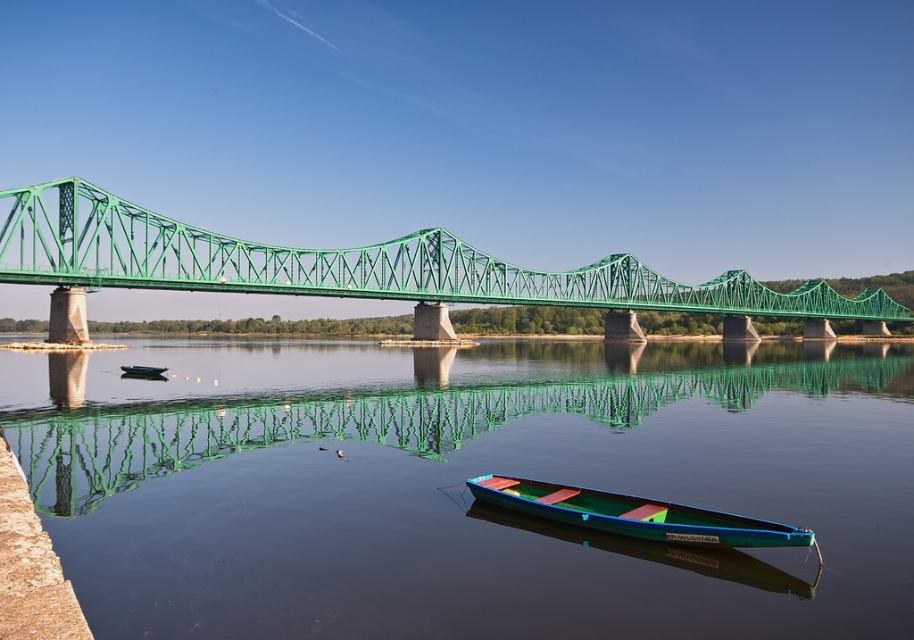
You are standing on the green truss bridge and notice a green plastic boat at center and smooth water at center. Which object is closer to the riverbank?

The smooth water at center is located below the green plastic boat at center, so the green plastic boat at center is closer to the riverbank than the smooth water at center.

You are standing at the riverside and want to reach the point marked as point (777, 604). Given that the bridge is 30 meters long, can you walk directly to that point using the bridge?

The point (777, 604) is 30.72 meters away from the viewer, which is slightly longer than the bridge length of 30 meters. Therefore, you cannot walk directly to that point using the bridge as it extends beyond the bridge.

You are standing at the edge of the river near the green truss bridge and want to place a small floating dock exactly at the point marked as point (468,488). According to the scene description, what will you find when you reach that location?

You will find smooth water at center at point (468,488), as the description states that at that point lies smooth water at center.